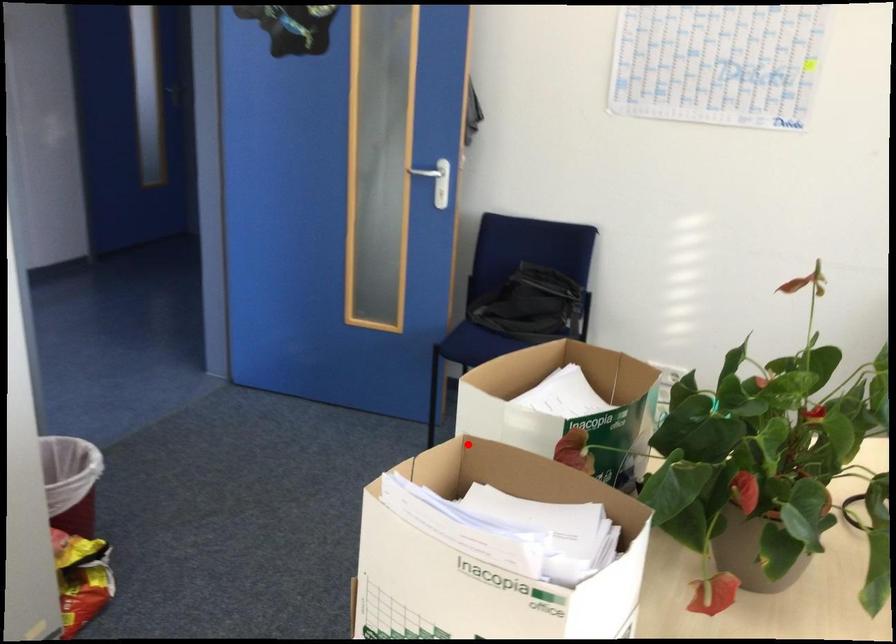
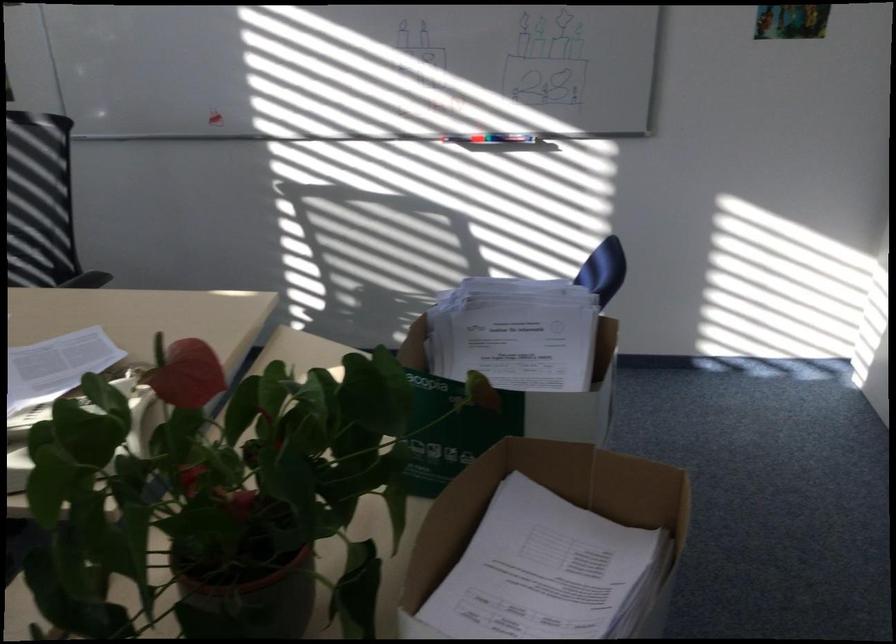
Find the pixel in the second image that matches the highlighted location in the first image.

(550, 515)